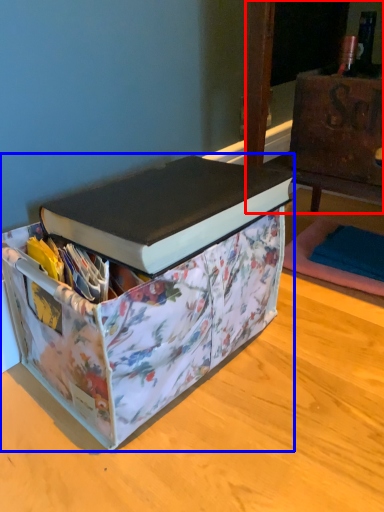
Question: Which object is closer to the camera taking this photo, furniture (highlighted by a red box) or box (highlighted by a blue box)?

Choices:
 (A) furniture
 (B) box

Answer: (B)